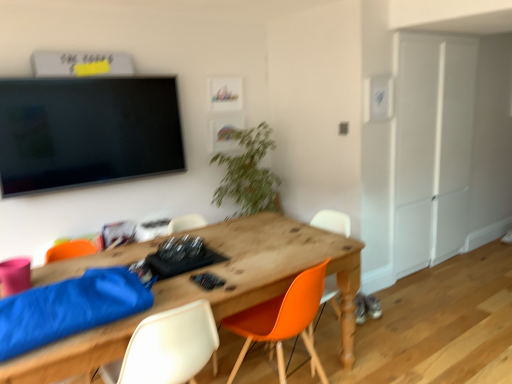
Question: Would you say orange matte chair at center, placed as the 1th chair when sorted from right to left, is to the left or to the right of wooden desk at center in the picture?

Choices:
 (A) right
 (B) left

Answer: (A)

Question: Considering their positions, is orange matte chair at center, placed as the 1th chair when sorted from right to left, located in front of or behind wooden desk at center?

Choices:
 (A) behind
 (B) front

Answer: (A)

Question: Estimate the real-world distances between objects in this image. Which object is closer to the orange plastic chair at center, which is the second chair in right-to-left order?

Choices:
 (A) white matte armoire at right
 (B) white plastic chair at lower center, which is the 1th chair from left to right
 (C) orange matte chair at center, placed as the 1th chair when sorted from right to left
 (D) wooden desk at center
 (E) green leafy plant at center

Answer: (D)

Question: Which object is the farthest from the wooden desk at center?

Choices:
 (A) white plastic chair at lower center, which is the 1th chair from left to right
 (B) orange matte chair at center, placed as the 1th chair when sorted from right to left
 (C) white matte armoire at right
 (D) orange plastic chair at center, which is the second chair from left to right
 (E) green leafy plant at center

Answer: (C)